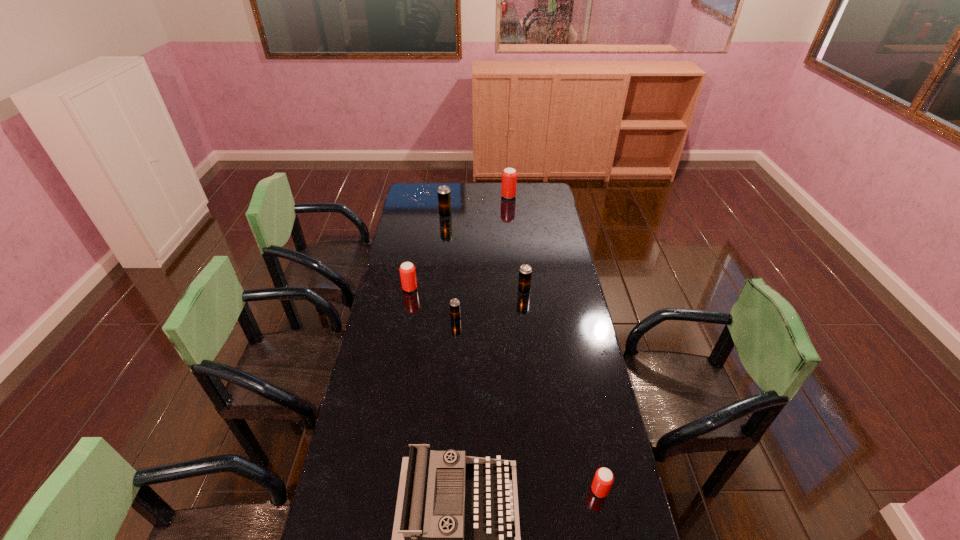
The image size is (960, 540). In order to click on the smallest black beer can in this screenshot , I will do `click(454, 303)`.

The height and width of the screenshot is (540, 960). I want to click on the second black beer can from left to right, so click(x=454, y=303).

At what (x,y) coordinates should I click in order to perform the action: click on vacant area situated 0.070m on the left of the farthest object. Please return your answer as a coordinate pair (x, y). The image size is (960, 540). Looking at the image, I should click on (489, 196).

Identify the location of free spot located on the right of the sixth nearest object. (503, 215).

I want to click on vacant space situated on the left of the second smallest black beer can, so click(x=452, y=291).

Where is `free space located on the back of the second smallest red beer can`? Image resolution: width=960 pixels, height=540 pixels. free space located on the back of the second smallest red beer can is located at coordinates pos(417,248).

Where is `vacant space positioned 0.280m on the left of the rightmost red beer can`? Image resolution: width=960 pixels, height=540 pixels. vacant space positioned 0.280m on the left of the rightmost red beer can is located at coordinates (495, 490).

What are the coordinates of `free space located on the right of the second black beer can from right to left` in the screenshot? It's located at point(483,319).

The height and width of the screenshot is (540, 960). I want to click on object at the far edge, so click(509, 175).

Locate an element on the screen. object present at the left edge is located at coordinates (407, 270).